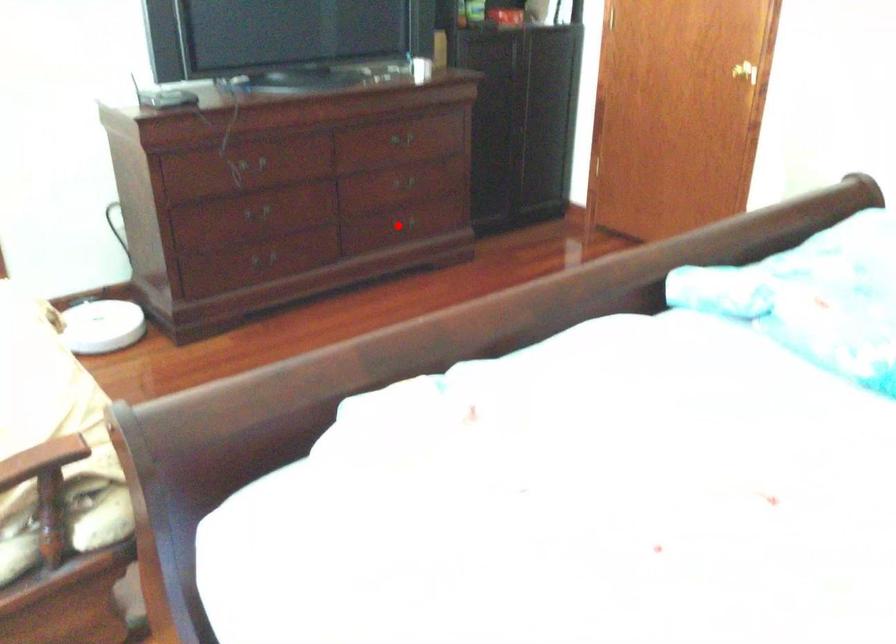
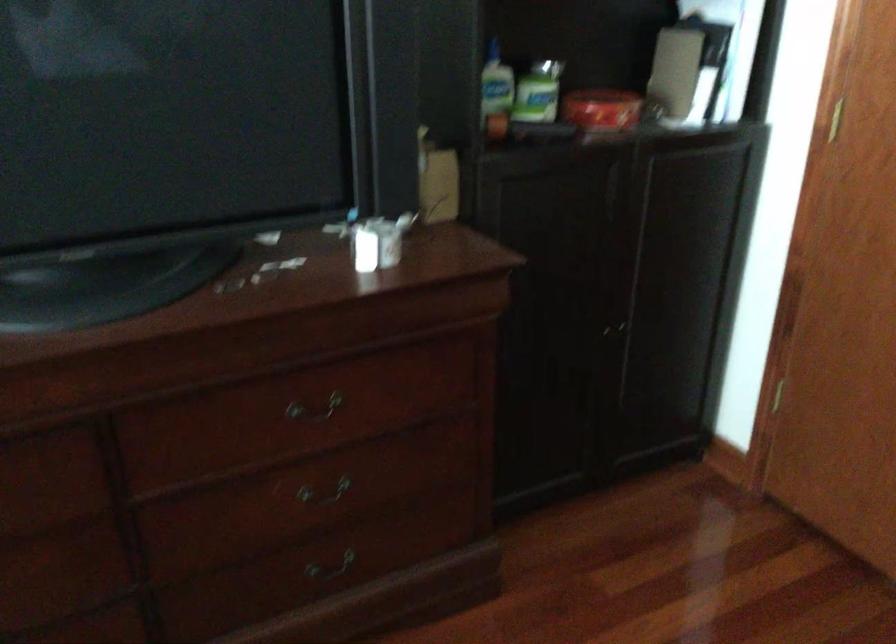
Question: I am providing you with two images of the same scene from different viewpoints. A red point is shown in image1. For the corresponding object point in image2, is it positioned nearer or farther from the camera?

Choices:
 (A) Nearer
 (B) Farther

Answer: (A)